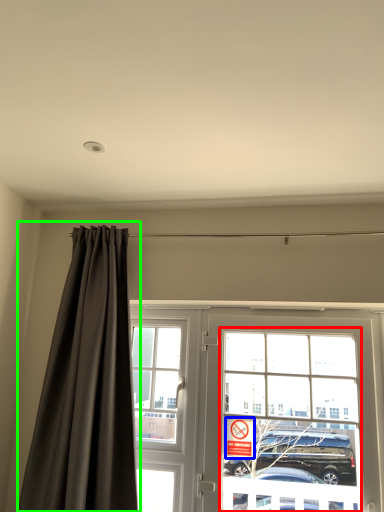
Question: Which object is positioned closest to bay window (highlighted by a red box)? Select from parking sign (highlighted by a blue box) and curtain (highlighted by a green box).

Choices:
 (A) parking sign
 (B) curtain

Answer: (A)